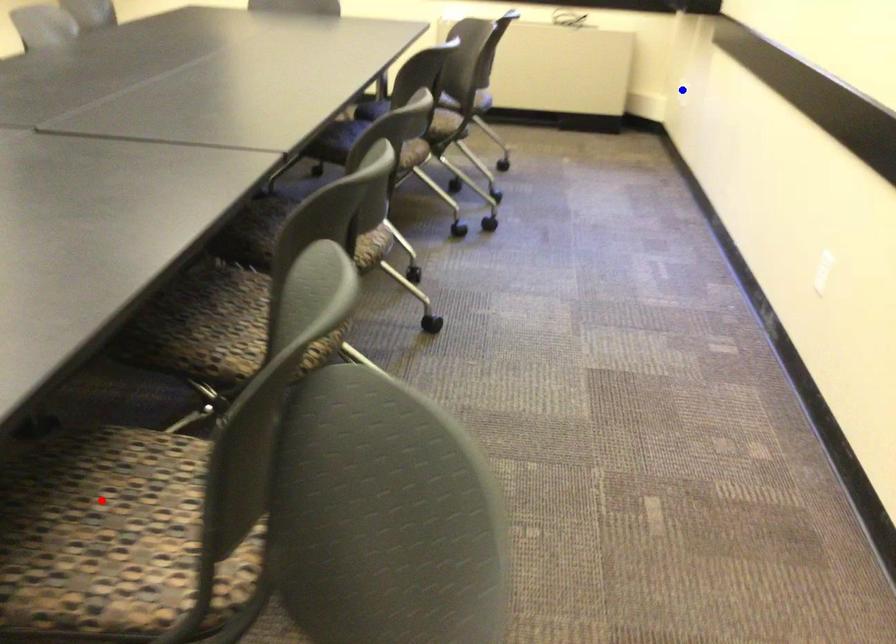
Question: In the image, two points are highlighted. Which point is nearer to the camera? Reply with the corresponding letter.

Choices:
 (A) blue point
 (B) red point

Answer: (B)